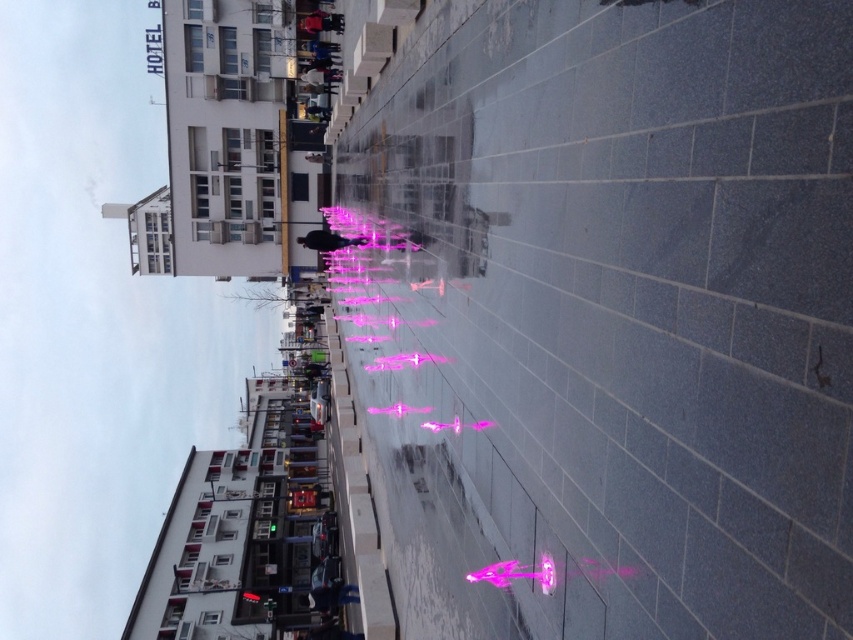
Question: Is pink glossy fountain at center smaller than matte black person at center?

Choices:
 (A) yes
 (B) no

Answer: (B)

Question: Which of the following is the closest to the observer?

Choices:
 (A) matte black person at center
 (B) pink glossy fountain at center

Answer: (B)

Question: Is pink glossy fountain at center to the right of matte black person at center from the viewer's perspective?

Choices:
 (A) no
 (B) yes

Answer: (B)

Question: Can you confirm if pink glossy fountain at center is positioned to the right of matte black person at center?

Choices:
 (A) no
 (B) yes

Answer: (B)

Question: Which of the following is the closest to the observer?

Choices:
 (A) matte black person at center
 (B) pink glossy fountain at center

Answer: (B)